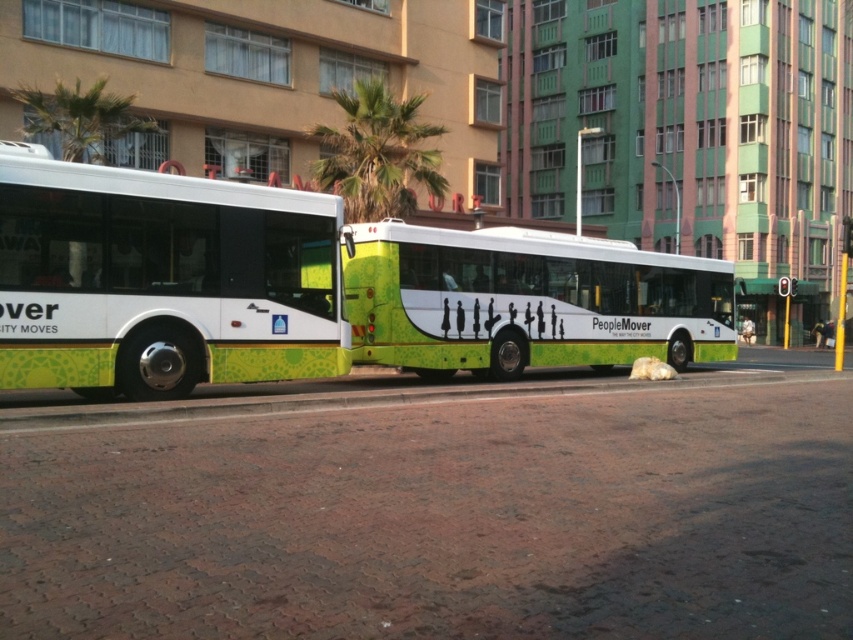
You are a GUI agent. You are given a task and a screenshot of the screen. Output one action in this format:
    pyautogui.click(x=<x>, y=<y>)
    Task: Click on the green matte bus at center
    The width and height of the screenshot is (853, 640).
    Given the screenshot: What is the action you would take?
    (527, 301)

Is green matte bus at center bigger than green leafy palm tree at upper left?

Indeed, green matte bus at center has a larger size compared to green leafy palm tree at upper left.

At what (x,y) coordinates should I click in order to perform the action: click on green matte bus at center. Please return your answer as a coordinate pair (x, y). The height and width of the screenshot is (640, 853). Looking at the image, I should click on (527, 301).

How much distance is there between white glossy bus at center and green leafy palm tree at upper left?

white glossy bus at center is 12.52 meters from green leafy palm tree at upper left.

Which is in front, point (212, 189) or point (68, 106)?

Positioned in front is point (212, 189).

What do you see at coordinates (161, 280) in the screenshot? I see `white glossy bus at center` at bounding box center [161, 280].

This screenshot has width=853, height=640. I want to click on white glossy bus at center, so (161, 280).

Is point (705, 342) farther from camera compared to point (415, 148)?

No, it is not.

Between green matte bus at center and green leafy palm tree at center, which one appears on the left side from the viewer's perspective?

Positioned to the left is green leafy palm tree at center.

Describe the element at coordinates (527, 301) in the screenshot. This screenshot has height=640, width=853. I see `green matte bus at center` at that location.

Identify the location of green matte bus at center. The height and width of the screenshot is (640, 853). (527, 301).